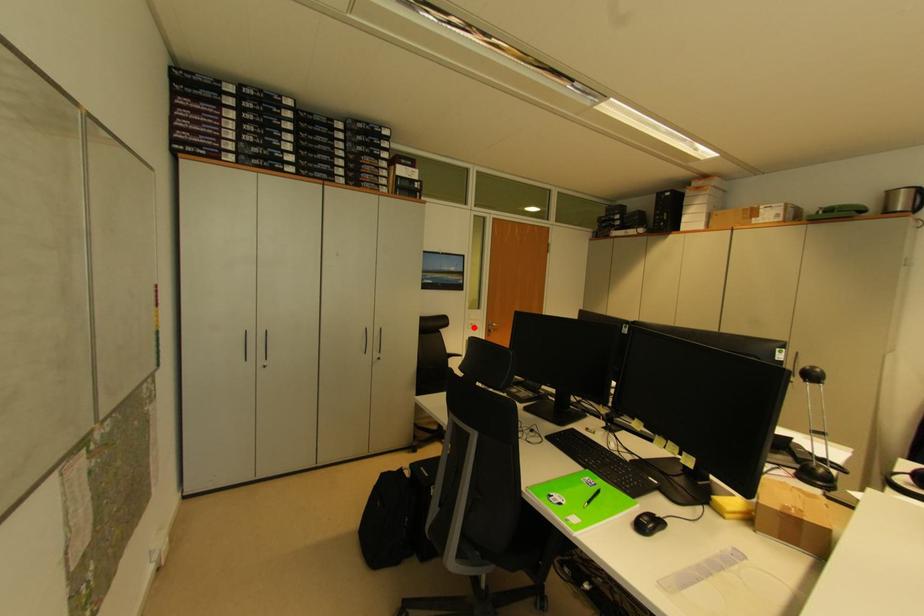
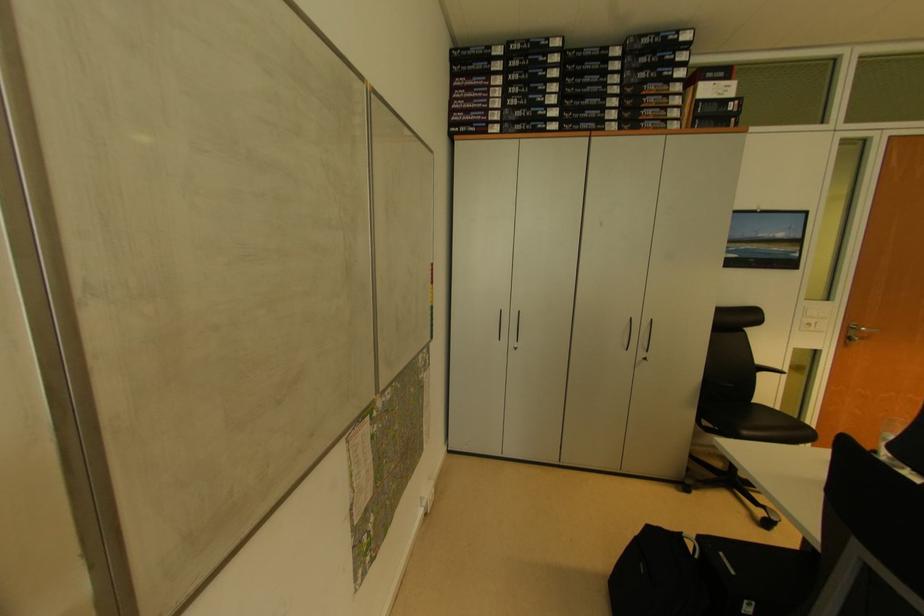
Find the pixel in the second image that matches the highlighted location in the first image.

(811, 328)